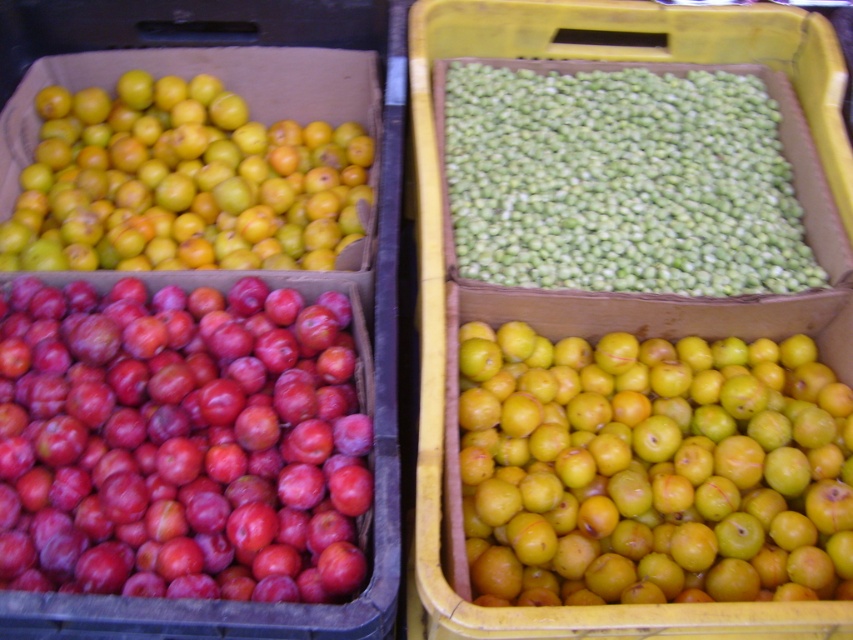
In the scene shown: Does yellow matte plums at center have a lesser width compared to matte cardboard box at left?

Yes.

Who is positioned more to the left, yellow matte plums at center or matte cardboard box at left?

matte cardboard box at left is more to the left.

Does point (525, 580) come closer to viewer compared to point (376, 476)?

That is False.

Where is `yellow matte plums at center`? The width and height of the screenshot is (853, 640). yellow matte plums at center is located at coordinates (653, 468).

Does yellow matte plums at center have a greater width compared to yellow matte plums at upper left?

Incorrect, yellow matte plums at center's width does not surpass yellow matte plums at upper left's.

Between yellow matte plums at center and yellow matte plums at upper left, which one has less height?

Standing shorter between the two is yellow matte plums at center.

Describe the element at coordinates (653, 468) in the screenshot. I see `yellow matte plums at center` at that location.

I want to click on yellow matte plums at center, so click(653, 468).

Does shiny red apples at center left have a greater width compared to green matte beans at center?

In fact, shiny red apples at center left might be narrower than green matte beans at center.

Is point (302, 484) closer to viewer compared to point (503, 97)?

Yes, it is.

This screenshot has height=640, width=853. Identify the location of shiny red apples at center left. (178, 442).